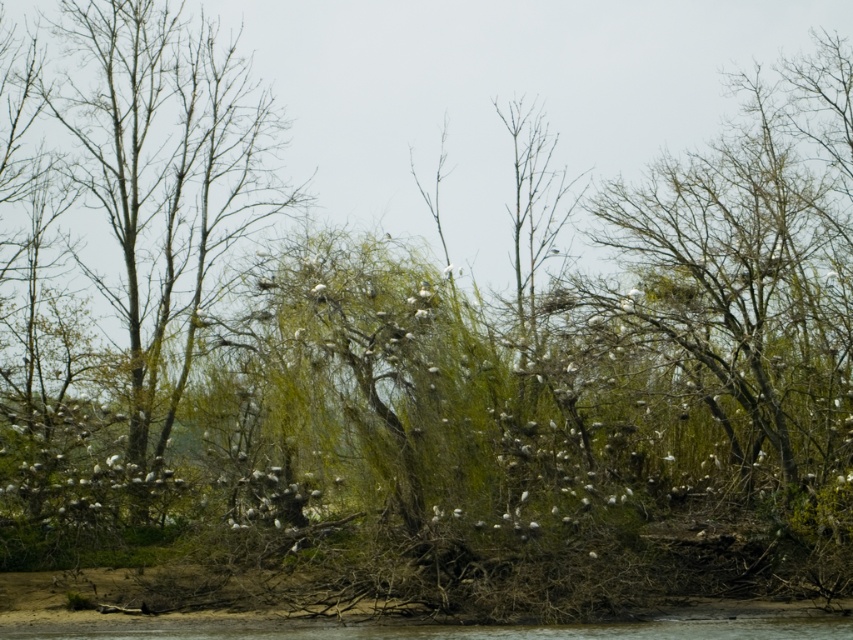
Question: Which point is farther from the camera taking this photo?

Choices:
 (A) (165, 134)
 (B) (621, 625)

Answer: (A)

Question: Does bare branches at left have a larger size compared to brown muddy river at lower center?

Choices:
 (A) yes
 (B) no

Answer: (A)

Question: Does bare branches at left appear on the right side of brown muddy river at lower center?

Choices:
 (A) no
 (B) yes

Answer: (A)

Question: Can you confirm if bare branches at left is positioned above brown muddy river at lower center?

Choices:
 (A) yes
 (B) no

Answer: (A)

Question: Among these points, which one is farthest from the camera?

Choices:
 (A) (808, 637)
 (B) (169, 280)

Answer: (B)